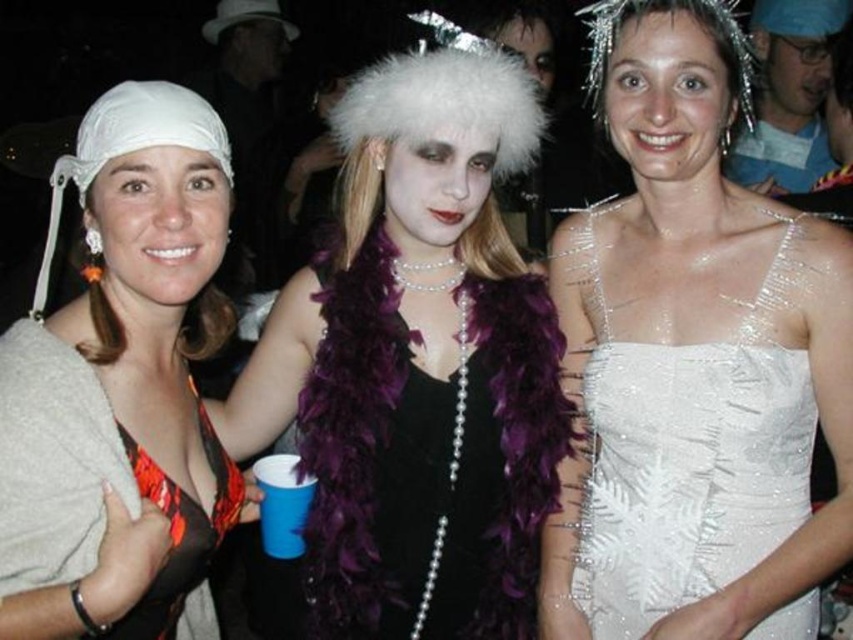
Question: Estimate the real-world distances between objects in this image. Which object is closer to the purple feather boa at center?

Choices:
 (A) white sequined dress at center
 (B) orange printed fabric bikini top at left

Answer: (A)

Question: Can you confirm if white sequined dress at center is positioned to the right of orange printed fabric bikini top at left?

Choices:
 (A) no
 (B) yes

Answer: (B)

Question: Does white sequined dress at center have a smaller size compared to orange printed fabric bikini top at left?

Choices:
 (A) yes
 (B) no

Answer: (B)

Question: Does purple feather boa at center have a smaller size compared to orange printed fabric bikini top at left?

Choices:
 (A) no
 (B) yes

Answer: (A)

Question: Among these objects, which one is nearest to the camera?

Choices:
 (A) purple feather boa at center
 (B) orange printed fabric bikini top at left

Answer: (B)

Question: Which of the following is the closest to the observer?

Choices:
 (A) (236, 435)
 (B) (111, 198)
 (C) (808, 227)

Answer: (B)